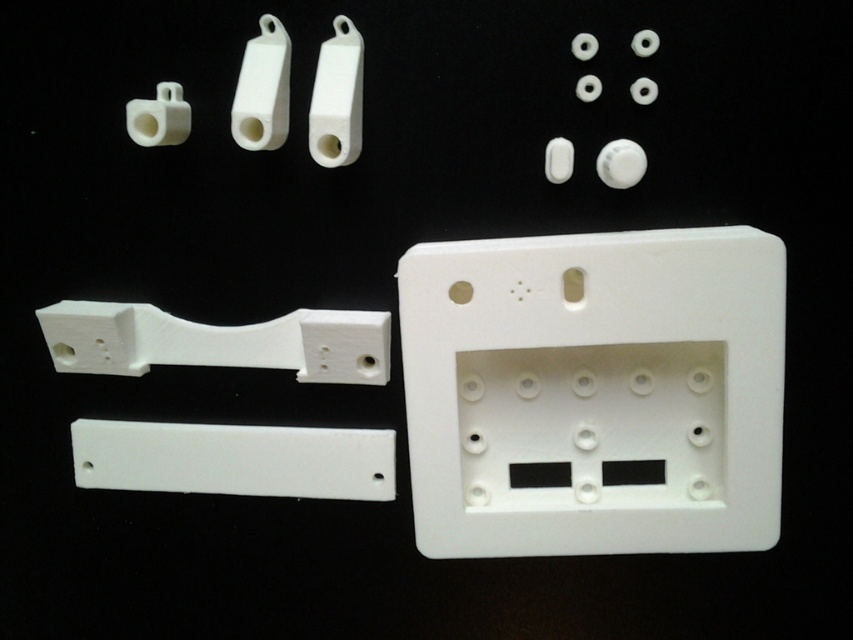
Question: Is white plastic electric outlet at center wider than white matte rectangular plate at lower left?

Choices:
 (A) no
 (B) yes

Answer: (B)

Question: Which of the following is the farthest from the observer?

Choices:
 (A) white matte rectangular plate at lower left
 (B) white plastic electric outlet at center

Answer: (A)

Question: Is white plastic electric outlet at center positioned at the back of white matte rectangular plate at lower left?

Choices:
 (A) yes
 (B) no

Answer: (B)

Question: Is white plastic electric outlet at center above white matte rectangular plate at lower left?

Choices:
 (A) yes
 (B) no

Answer: (A)